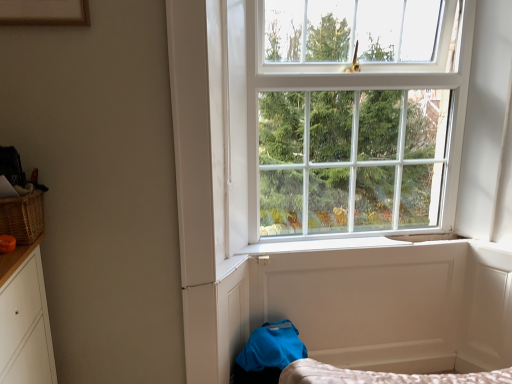
You are a GUI agent. You are given a task and a screenshot of the screen. Output one action in this format:
    pyautogui.click(x=<x>, y=<y>)
    Task: Click on the wooden picture frame at upper left
    The width and height of the screenshot is (512, 384).
    Given the screenshot: What is the action you would take?
    pyautogui.click(x=44, y=12)

What is the approximate height of white smooth window sill at center?

It is 0.73 inches.

The image size is (512, 384). In order to click on woven brown basket at left in this screenshot , I will do `click(23, 217)`.

Is wooden picture frame at upper left positioned with its back to white smooth window sill at center?

wooden picture frame at upper left is not turned away from white smooth window sill at center.

Does point (66, 24) come farther from viewer compared to point (361, 242)?

No, it is not.

From the image's perspective, which is above, wooden picture frame at upper left or white smooth window sill at center?

wooden picture frame at upper left is shown above in the image.

In terms of height, does wooden picture frame at upper left look taller or shorter compared to white smooth window sill at center?

Considering their sizes, wooden picture frame at upper left has more height than white smooth window sill at center.

Which object is thinner, woven brown basket at left or white smooth window sill at center?

With smaller width is white smooth window sill at center.

From the image's perspective, is woven brown basket at left above or below white smooth window sill at center?

Based on their image positions, woven brown basket at left is located above white smooth window sill at center.

Does woven brown basket at left come behind white smooth window sill at center?

That is False.

Is white smooth window sill at center a part of woven brown basket at left?

No.

Which is in front, point (389, 239) or point (57, 21)?

The point (57, 21) is more forward.

Which object is positioned more to the left, white smooth window sill at center or wooden picture frame at upper left?

wooden picture frame at upper left is more to the left.

Who is bigger, white smooth window sill at center or wooden picture frame at upper left?

With larger size is wooden picture frame at upper left.

From the image's perspective, is white smooth window sill at center on top of wooden picture frame at upper left?

No, from the image's perspective, white smooth window sill at center is not over wooden picture frame at upper left.

Is the depth of woven brown basket at left greater than that of wooden picture frame at upper left?

That is True.

From a real-world perspective, which object stands above the other?

wooden picture frame at upper left is physically above.

Considering the sizes of objects woven brown basket at left and wooden picture frame at upper left in the image provided, who is thinner, woven brown basket at left or wooden picture frame at upper left?

Thinner between the two is wooden picture frame at upper left.

Does white wooden window at upper center have a lesser width compared to woven brown basket at left?

Incorrect, the width of white wooden window at upper center is not less than that of woven brown basket at left.

Who is bigger, white wooden window at upper center or woven brown basket at left?

With larger size is white wooden window at upper center.

Between point (452, 169) and point (2, 215), which one is positioned in front?

The point (2, 215) is more forward.

From a real-world perspective, is white wooden window at upper center physically above woven brown basket at left?

Yes.

Is wooden picture frame at upper left oriented away from woven brown basket at left?

No, wooden picture frame at upper left's orientation is not away from woven brown basket at left.

Is point (51, 1) positioned behind point (14, 208)?

No.

Would you consider wooden picture frame at upper left to be distant from woven brown basket at left?

No, wooden picture frame at upper left is in close proximity to woven brown basket at left.

Could you tell me if woven brown basket at left is turned towards white wooden window at upper center?

No, woven brown basket at left does not turn towards white wooden window at upper center.

Which of these two, woven brown basket at left or white wooden window at upper center, is bigger?

With larger size is white wooden window at upper center.

From the image's perspective, is woven brown basket at left located above white wooden window at upper center?

Actually, woven brown basket at left appears below white wooden window at upper center in the image.

In the image, there is a wooden picture frame at upper left. Where is `window sill below it (from a real-world perspective)`? window sill below it (from a real-world perspective) is located at coordinates (345, 243).

Find the location of `basket on the left of white smooth window sill at center`. basket on the left of white smooth window sill at center is located at coordinates (23, 217).

From the image, which object appears to be farther from wooden picture frame at upper left, white wooden window at upper center or woven brown basket at left?

white wooden window at upper center is further to wooden picture frame at upper left.

Looking at this image, based on their spatial positions, is white wooden window at upper center or wooden picture frame at upper left further from woven brown basket at left?

white wooden window at upper center is positioned further to the anchor woven brown basket at left.

When comparing their distances from white wooden window at upper center, does white smooth window sill at center or woven brown basket at left seem further?

woven brown basket at left.

From the image, which object appears to be farther from white smooth window sill at center, white wooden window at upper center or wooden picture frame at upper left?

Among the two, wooden picture frame at upper left is located further to white smooth window sill at center.

Consider the image. From the image, which object appears to be nearer to woven brown basket at left, white smooth window sill at center or wooden picture frame at upper left?

Among the two, wooden picture frame at upper left is located nearer to woven brown basket at left.

When comparing their distances from woven brown basket at left, does white wooden window at upper center or white smooth window sill at center seem closer?

Based on the image, white smooth window sill at center appears to be nearer to woven brown basket at left.

Based on their spatial positions, is woven brown basket at left or white wooden window at upper center further from wooden picture frame at upper left?

white wooden window at upper center lies further to wooden picture frame at upper left than the other object.

Estimate the real-world distances between objects in this image. Which object is closer to woven brown basket at left, white smooth window sill at center or white wooden window at upper center?

white smooth window sill at center is closer to woven brown basket at left.

In order to click on window sill between wooden picture frame at upper left and white wooden window at upper center from left to right in this screenshot , I will do `click(345, 243)`.

The height and width of the screenshot is (384, 512). Find the location of `window sill located between woven brown basket at left and white wooden window at upper center in the left-right direction`. window sill located between woven brown basket at left and white wooden window at upper center in the left-right direction is located at coordinates (345, 243).

At what (x,y) coordinates should I click in order to perform the action: click on picture frame located between woven brown basket at left and white smooth window sill at center in the left-right direction. Please return your answer as a coordinate pair (x, y). The width and height of the screenshot is (512, 384). Looking at the image, I should click on (44, 12).

Locate an element on the screen. The width and height of the screenshot is (512, 384). picture frame situated between woven brown basket at left and white wooden window at upper center from left to right is located at coordinates (44, 12).